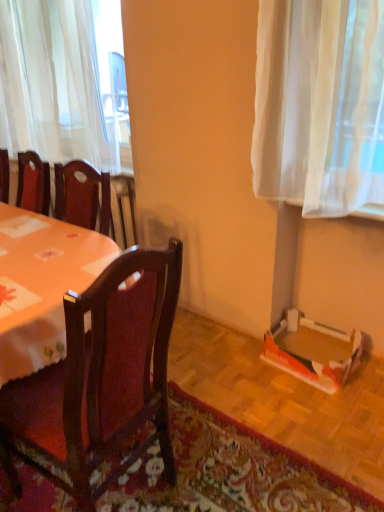
I want to click on vacant space underneath orange cardboard box at lower right (from a real-world perspective), so click(302, 353).